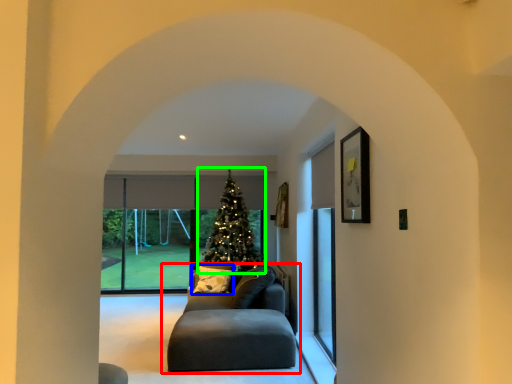
Question: Which is nearer to the studio couch (highlighted by a red box)? pillow (highlighted by a blue box) or christmas tree (highlighted by a green box).

Choices:
 (A) pillow
 (B) christmas tree

Answer: (A)